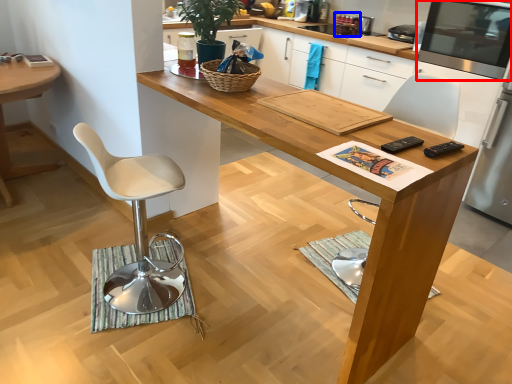
Question: Which object is further to the camera taking this photo, appliance (highlighted by a red box) or appliance (highlighted by a blue box)?

Choices:
 (A) appliance
 (B) appliance

Answer: (B)